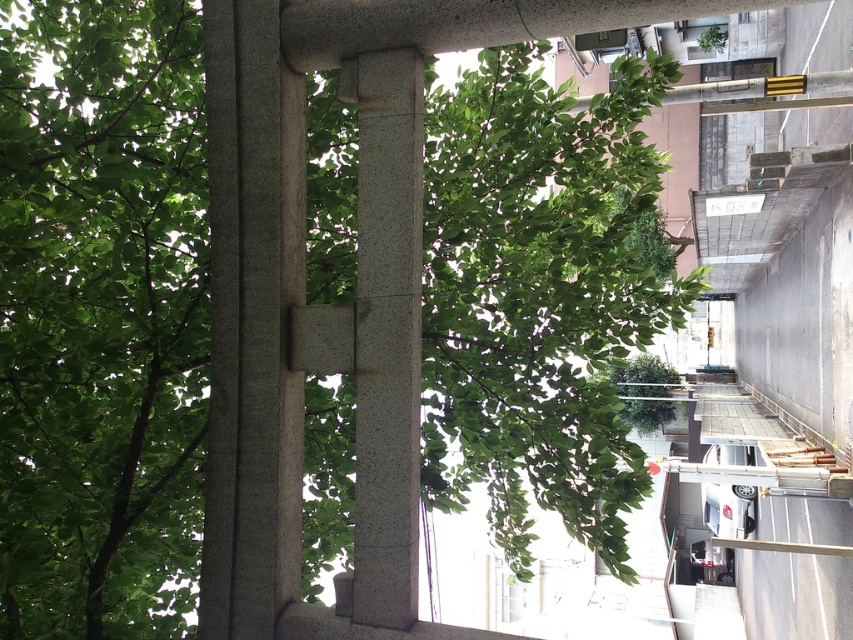
Between slate gray stone pillar at center and smooth gray stone pillar at center, which one is positioned higher?

Positioned higher is slate gray stone pillar at center.

Is point (294, 564) farther from viewer compared to point (389, 209)?

Yes.

You are a GUI agent. You are given a task and a screenshot of the screen. Output one action in this format:
    pyautogui.click(x=<x>, y=<y>)
    Task: Click on the slate gray stone pillar at center
    
    Given the screenshot: What is the action you would take?
    pyautogui.click(x=252, y=321)